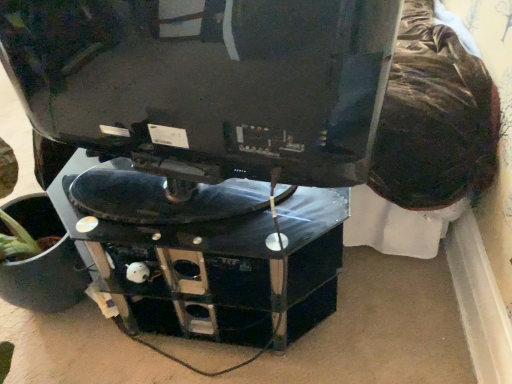
Question: Is matte black monitor at upper center inside or outside of black glossy computer desk at center?

Choices:
 (A) inside
 (B) outside

Answer: (B)

Question: Considering their positions, is matte black monitor at upper center located in front of or behind black glossy computer desk at center?

Choices:
 (A) front
 (B) behind

Answer: (A)

Question: Considering the relative positions of matte black monitor at upper center and black glossy computer desk at center in the image provided, is matte black monitor at upper center to the left or to the right of black glossy computer desk at center?

Choices:
 (A) left
 (B) right

Answer: (A)

Question: Relative to matte black monitor at upper center, is black glossy computer desk at center in front or behind?

Choices:
 (A) behind
 (B) front

Answer: (A)

Question: Is point (231, 301) closer or farther from the camera than point (365, 84)?

Choices:
 (A) closer
 (B) farther

Answer: (B)

Question: Considering the relative positions of black glossy computer desk at center and matte black monitor at upper center in the image provided, is black glossy computer desk at center to the left or to the right of matte black monitor at upper center?

Choices:
 (A) left
 (B) right

Answer: (B)

Question: In terms of size, does black glossy computer desk at center appear bigger or smaller than matte black monitor at upper center?

Choices:
 (A) small
 (B) big

Answer: (B)